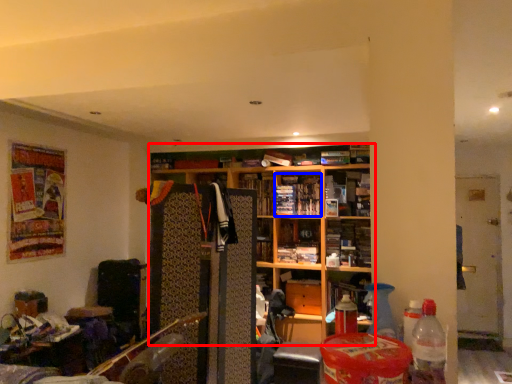
Question: Which object appears farthest to the camera in this image, shelf (highlighted by a red box) or book (highlighted by a blue box)?

Choices:
 (A) shelf
 (B) book

Answer: (B)